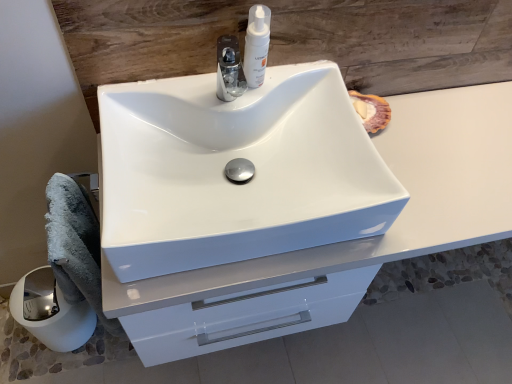
Find the location of a particular element. Image resolution: width=512 pixels, height=384 pixels. vacant space to the right of white glossy sink at center is located at coordinates (435, 171).